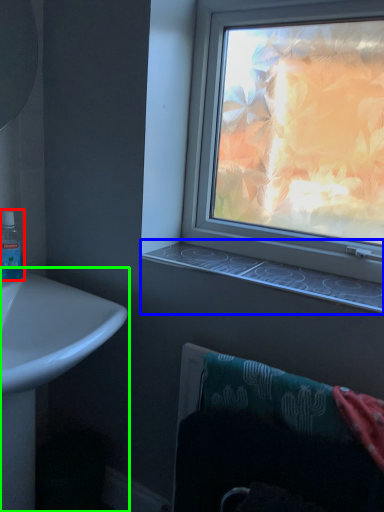
Question: Which is nearer to the mouthwash (highlighted by a red box)? window sill (highlighted by a blue box) or sink (highlighted by a green box).

Choices:
 (A) window sill
 (B) sink

Answer: (B)